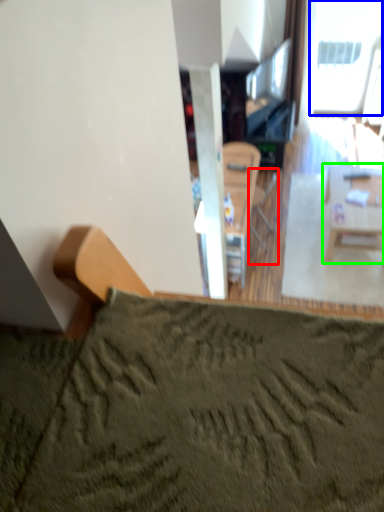
Question: Estimate the real-world distances between objects in this image. Which object is closer to armchair (highlighted by a red box), window (highlighted by a blue box) or table (highlighted by a green box)?

Choices:
 (A) window
 (B) table

Answer: (B)